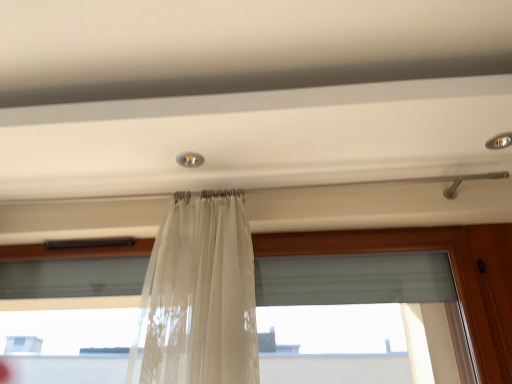
What do you see at coordinates (453, 274) in the screenshot? This screenshot has width=512, height=384. I see `translucent fabric at center` at bounding box center [453, 274].

Image resolution: width=512 pixels, height=384 pixels. Identify the location of translucent fabric at center. click(453, 274).

Locate an element on the screen. Image resolution: width=512 pixels, height=384 pixels. translucent fabric at center is located at coordinates (453, 274).